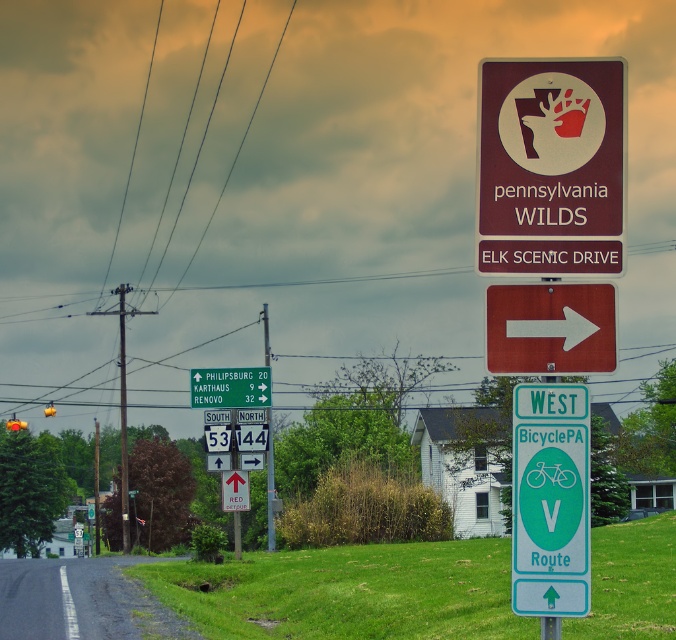
Question: Where is maroon plastic sign at upper right located in relation to metallic signpost at center in the image?

Choices:
 (A) below
 (B) above

Answer: (B)

Question: Which point is closer to the camera?

Choices:
 (A) maroon plastic sign at upper right
 (B) green plastic road sign at upper center

Answer: (A)

Question: Which of these objects is positioned closest to the green plastic road sign at upper center?

Choices:
 (A) maroon plastic sign at upper right
 (B) green plastic bicycle sign at right
 (C) metallic signpost at center

Answer: (C)

Question: Is maroon plastic sign at upper right wider than metallic signpost at center?

Choices:
 (A) yes
 (B) no

Answer: (B)

Question: Among these objects, which one is nearest to the camera?

Choices:
 (A) metallic signpost at center
 (B) green plastic bicycle sign at right
 (C) green plastic road sign at upper center
 (D) maroon plastic sign at upper right

Answer: (B)

Question: Is the position of green plastic road sign at upper center more distant than that of metallic signpost at center?

Choices:
 (A) no
 (B) yes

Answer: (A)